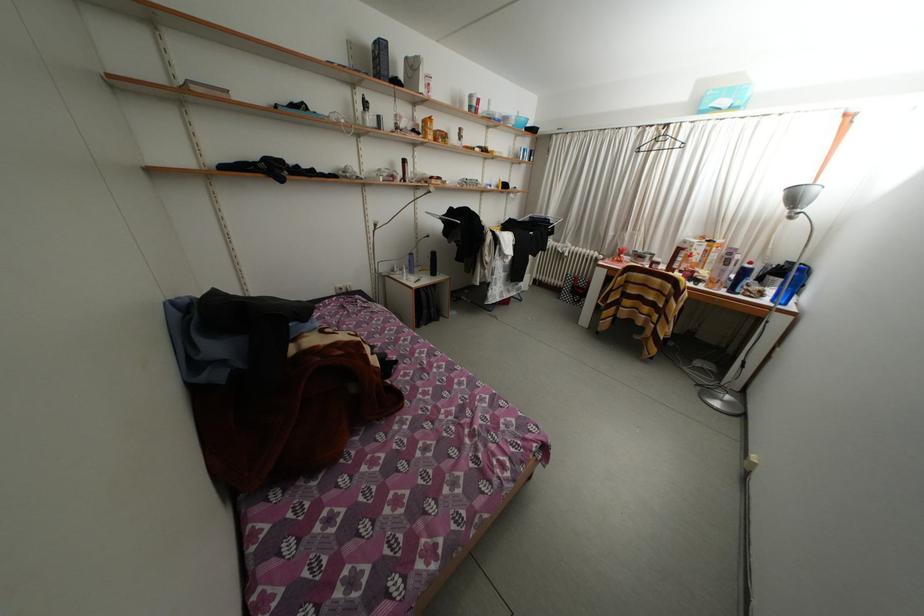
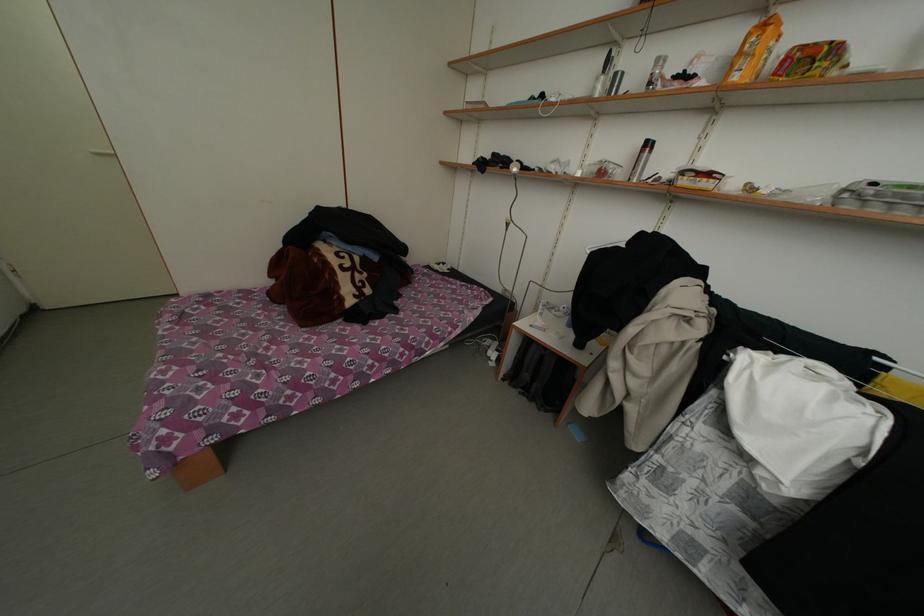
Find the pixel in the second image that matches (x=371, y=124) in the first image.

(602, 94)